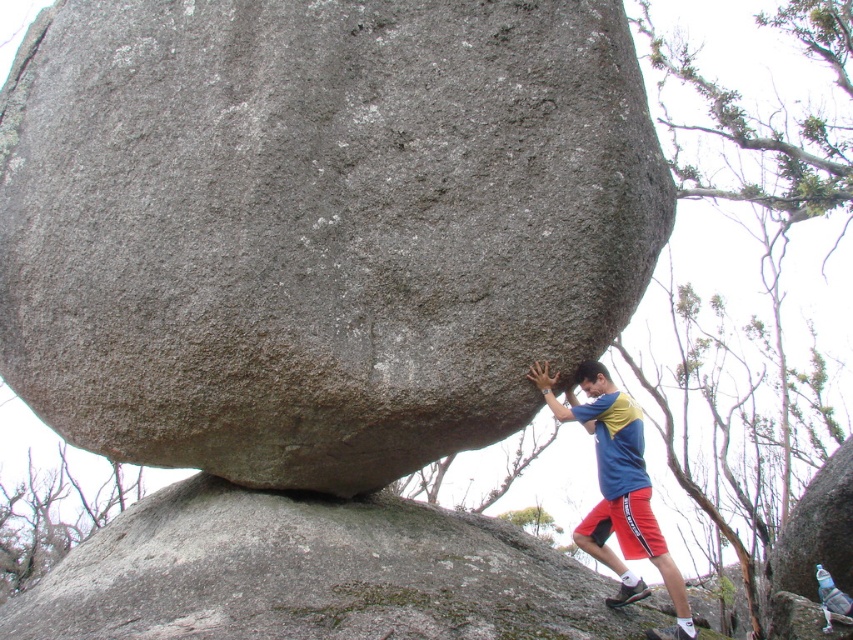
You are standing in front of the large boulder and want to place a small flag at point (425,109) and another flag at point (578,540). Which flag will be closer to your eyes?

Point (425,109) is closer to the camera than point (578,540), so the flag placed at point (425,109) will be closer to your eyes.